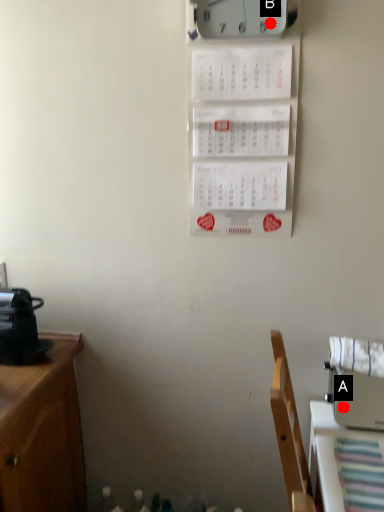
Question: Two points are circled on the image, labeled by A and B beside each circle. Which point is farther to the camera?

Choices:
 (A) A is further
 (B) B is further

Answer: (A)